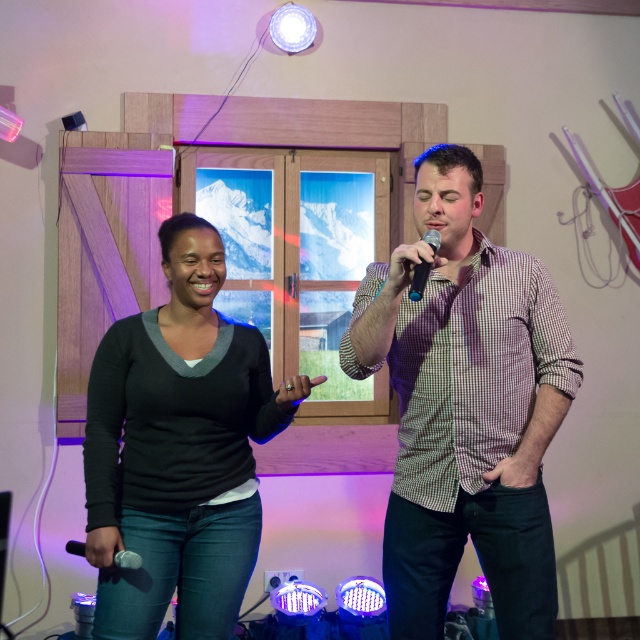
Question: Can you confirm if checkered fabric shirt at center is positioned to the left of black matte microphone at center?

Choices:
 (A) yes
 (B) no

Answer: (B)

Question: Which of the following is the farthest from the observer?

Choices:
 (A) black matte sweater at center
 (B) checkered fabric shirt at center
 (C) matte black shirt at center

Answer: (A)

Question: Which of the following is the farthest from the observer?

Choices:
 (A) (259, 342)
 (B) (433, 243)
 (C) (477, 212)

Answer: (A)

Question: Can you confirm if black matte sweater at center is positioned to the right of black matte microphone at center?

Choices:
 (A) no
 (B) yes

Answer: (A)

Question: Is black matte microphone at center closer to camera compared to silver metallic microphone at lower left?

Choices:
 (A) no
 (B) yes

Answer: (B)

Question: Among these objects, which one is farthest from the camera?

Choices:
 (A) silver metallic microphone at lower left
 (B) checkered fabric shirt at center

Answer: (A)